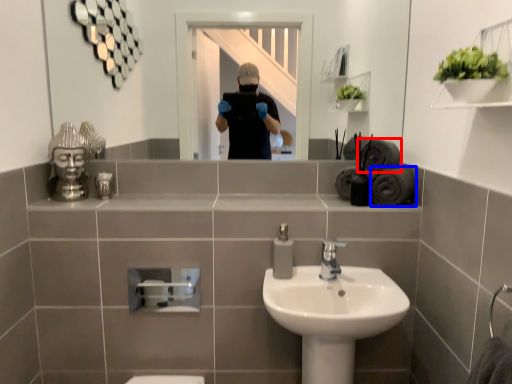
Question: Among these objects, which one is nearest to the camera, bath towel (highlighted by a red box) or bath towel (highlighted by a blue box)?

Choices:
 (A) bath towel
 (B) bath towel

Answer: (B)